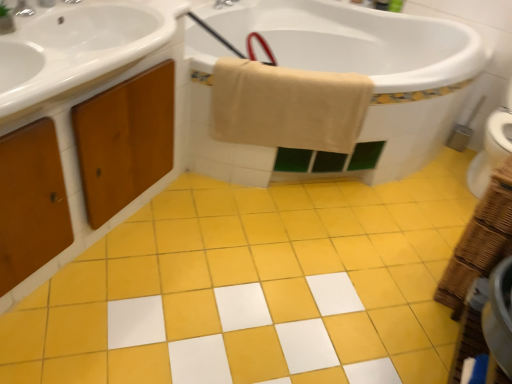
Question: Can you confirm if wooden cabinet at left is wider than brushed metal faucet at upper center, placed as the 2th tap when sorted from bottom to top?

Choices:
 (A) yes
 (B) no

Answer: (A)

Question: Is wooden cabinet at left positioned far away from brushed metal faucet at upper center, marked as the 1th tap in a right-to-left arrangement?

Choices:
 (A) yes
 (B) no

Answer: (A)

Question: Does wooden cabinet at left have a lesser height compared to brushed metal faucet at upper center, marked as the 1th tap in a right-to-left arrangement?

Choices:
 (A) no
 (B) yes

Answer: (A)

Question: From the image's perspective, is wooden cabinet at left over brushed metal faucet at upper center, marked as the 1th tap in a right-to-left arrangement?

Choices:
 (A) no
 (B) yes

Answer: (A)

Question: Does wooden cabinet at left have a larger size compared to brushed metal faucet at upper center, acting as the second tap starting from the front?

Choices:
 (A) no
 (B) yes

Answer: (B)

Question: Would you say wooden cabinet at left is outside brushed metal faucet at upper center, which ranks as the second tap in left-to-right order?

Choices:
 (A) no
 (B) yes

Answer: (B)

Question: Is the position of yellow matte tile at center less distant than that of brushed metal faucet at upper center, which ranks as the second tap in left-to-right order?

Choices:
 (A) yes
 (B) no

Answer: (A)

Question: Can you confirm if yellow matte tile at center is positioned to the right of brushed metal faucet at upper center, placed as the first tap when sorted from top to bottom?

Choices:
 (A) yes
 (B) no

Answer: (A)

Question: Is the surface of yellow matte tile at center in direct contact with brushed metal faucet at upper center, placed as the 2th tap when sorted from bottom to top?

Choices:
 (A) no
 (B) yes

Answer: (A)

Question: Is yellow matte tile at center not near brushed metal faucet at upper center, which is the first tap in back-to-front order?

Choices:
 (A) yes
 (B) no

Answer: (A)

Question: Considering the relative sizes of yellow matte tile at center and brushed metal faucet at upper center, placed as the first tap when sorted from top to bottom, in the image provided, is yellow matte tile at center taller than brushed metal faucet at upper center, placed as the first tap when sorted from top to bottom,?

Choices:
 (A) no
 (B) yes

Answer: (A)

Question: From a real-world perspective, is yellow matte tile at center physically above brushed metal faucet at upper center, which is the first tap in back-to-front order?

Choices:
 (A) yes
 (B) no

Answer: (B)

Question: Are brushed metal faucet at upper center, acting as the second tap starting from the front, and yellow matte tile at center making contact?

Choices:
 (A) no
 (B) yes

Answer: (A)